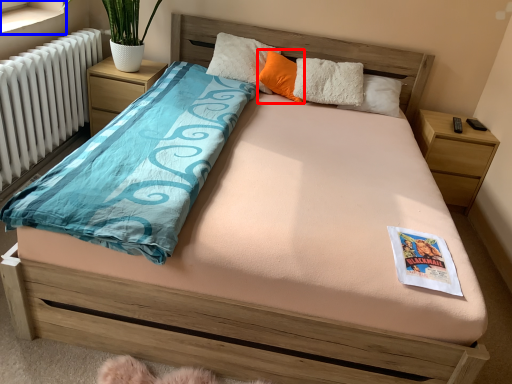
Question: Among these objects, which one is farthest to the camera, pillow (highlighted by a red box) or window sill (highlighted by a blue box)?

Choices:
 (A) pillow
 (B) window sill

Answer: (A)